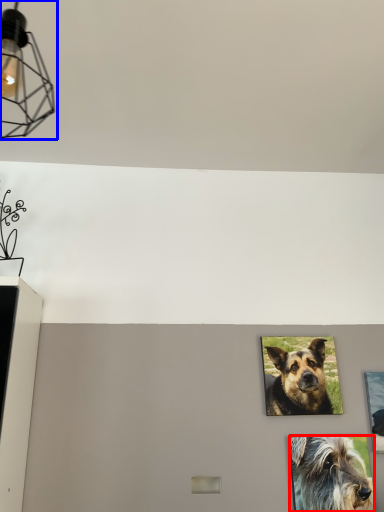
Question: Among these objects, which one is nearest to the camera, dog (highlighted by a red box) or light fixture (highlighted by a blue box)?

Choices:
 (A) dog
 (B) light fixture

Answer: (B)